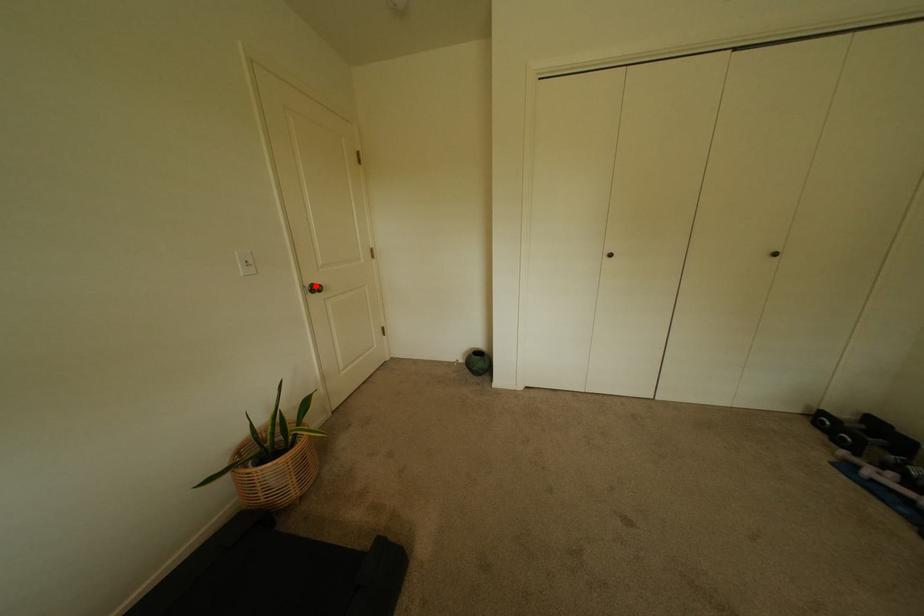
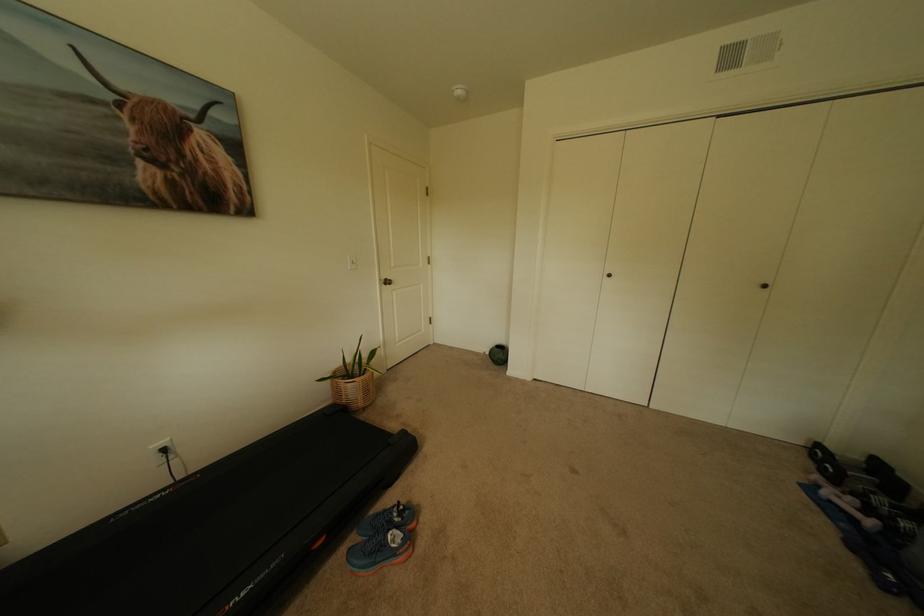
The point at the highlighted location is marked in the first image. Where is the corresponding point in the second image?

(391, 280)